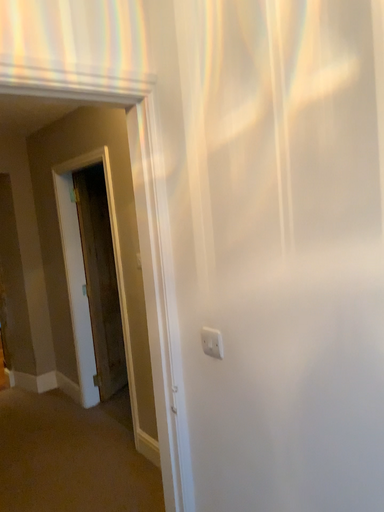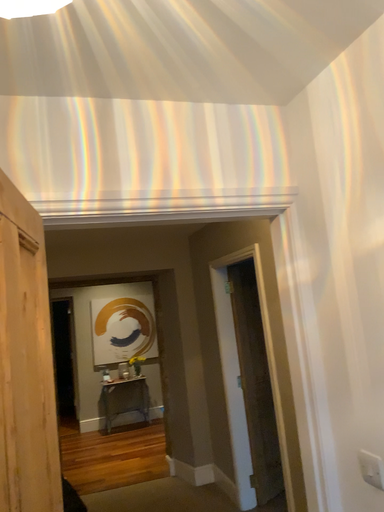
Question: Which way did the camera rotate in the video?

Choices:
 (A) rotated left
 (B) rotated right

Answer: (A)